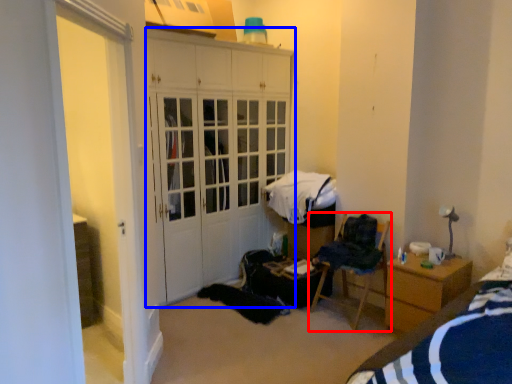
Question: Which of the following is the closest to the observer, chair (highlighted by a red box) or cabinetry (highlighted by a blue box)?

Choices:
 (A) chair
 (B) cabinetry

Answer: (A)